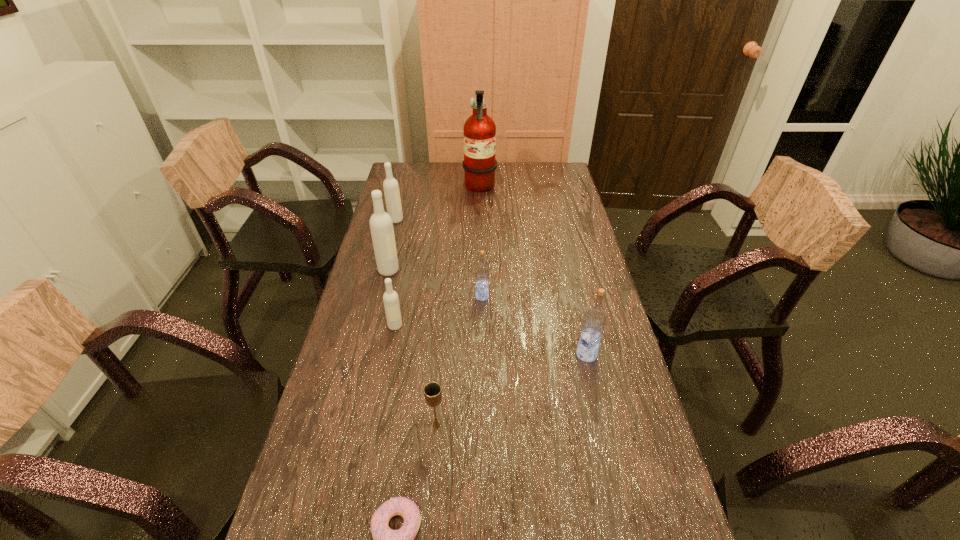
What are the coordinates of `fire extinguisher` in the screenshot? It's located at (479, 164).

Identify the location of the farthest object. (479, 164).

This screenshot has height=540, width=960. I want to click on the second farthest white vodka, so click(x=381, y=225).

Image resolution: width=960 pixels, height=540 pixels. I want to click on the sixth nearest object, so click(x=381, y=225).

Where is `the seventh nearest object`? the seventh nearest object is located at coordinates (390, 185).

Find the location of `the farthest vodka`. the farthest vodka is located at coordinates (390, 185).

At what (x,y) coordinates should I click in order to perform the action: click on the nearer blue vodka. Please return your answer as a coordinate pair (x, y). This screenshot has width=960, height=540. Looking at the image, I should click on (594, 320).

Identify the location of the sixth farthest object. This screenshot has width=960, height=540. (594, 320).

Image resolution: width=960 pixels, height=540 pixels. Identify the location of the rightmost white vodka. (390, 298).

The height and width of the screenshot is (540, 960). Find the location of `the nearest white vodka`. the nearest white vodka is located at coordinates (390, 298).